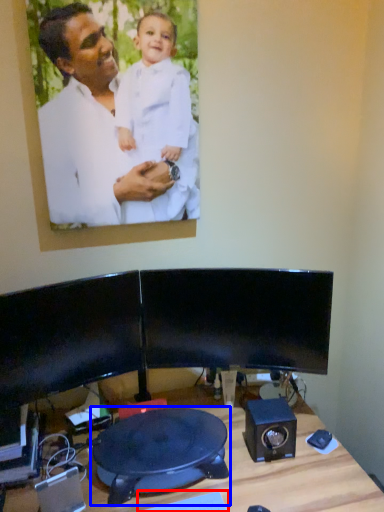
Question: Which of the following is the farthest to the observer, keyboard (highlighted by a red box) or swivel chair (highlighted by a blue box)?

Choices:
 (A) keyboard
 (B) swivel chair

Answer: (B)